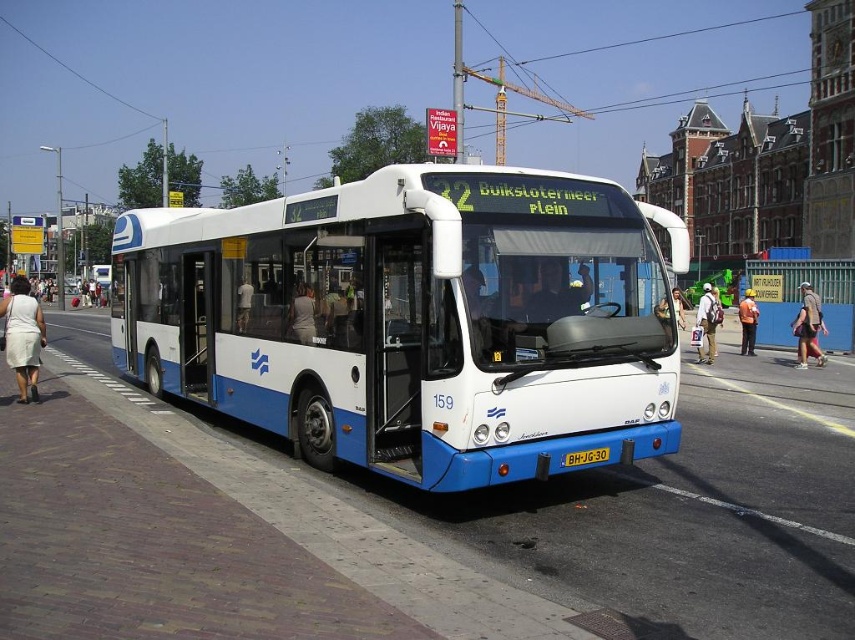
Is denim jacket at lower right smaller than light gray fabric shirt at center?

Actually, denim jacket at lower right might be larger than light gray fabric shirt at center.

Is denim jacket at lower right closer to camera compared to light gray fabric shirt at center?

No, it is behind light gray fabric shirt at center.

Who is more forward, (803, 333) or (314, 332)?

Point (314, 332) is more forward.

Identify the location of denim jacket at lower right. The height and width of the screenshot is (640, 855). (808, 326).

Does point (384, 307) lie in front of point (800, 308)?

Yes, it is in front of point (800, 308).

Does white matte bus at center appear on the left side of denim jacket at lower right?

Correct, you'll find white matte bus at center to the left of denim jacket at lower right.

Between point (638, 225) and point (817, 346), which one is positioned in front?

Positioned in front is point (638, 225).

At what (x,y) coordinates should I click in order to perform the action: click on white matte bus at center. Please return your answer as a coordinate pair (x, y). This screenshot has width=855, height=640. Looking at the image, I should click on (416, 321).

Does light beige fabric dress at lower left have a lesser height compared to orange fabric jacket at center?

No.

How distant is light beige fabric dress at lower left from orange fabric jacket at center?

17.18 meters

The width and height of the screenshot is (855, 640). What do you see at coordinates (22, 337) in the screenshot?
I see `light beige fabric dress at lower left` at bounding box center [22, 337].

This screenshot has height=640, width=855. What are the coordinates of `light beige fabric dress at lower left` in the screenshot? It's located at [x=22, y=337].